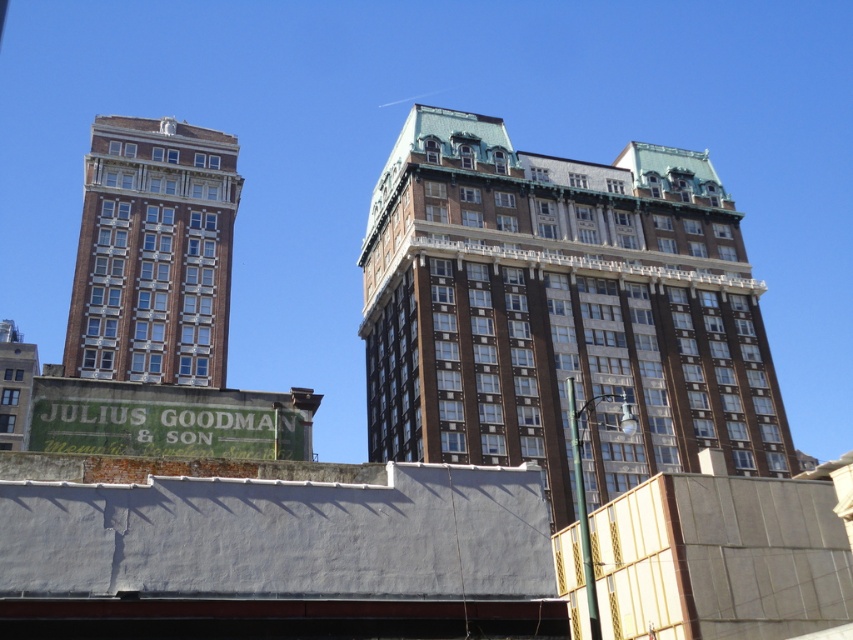
Looking at this image, you are standing in front of the two buildings shown in the image. You notice two points marked on the ground in front of you. The first point is at coordinates point (668, 307) and the second is at point (169, 368). Which point is closer to your current position?

Point (668, 307) is closer to your current position because it is further to the camera than point (169, 368).

You are a city planner assessing the skyline. You see the brown brick building at center and the brown brick building at left. Which one appears taller in the image?

The brown brick building at center appears taller than the brown brick building at left.

You are a city planner reviewing the layout of a new urban development. You need to determine which building has more space for expansion between the brown brick building at center and the brown brick building at left. Based on their sizes, which one would allow for more expansion?

The brown brick building at center is larger in size than the brown brick building at left, so it would allow for more expansion space.